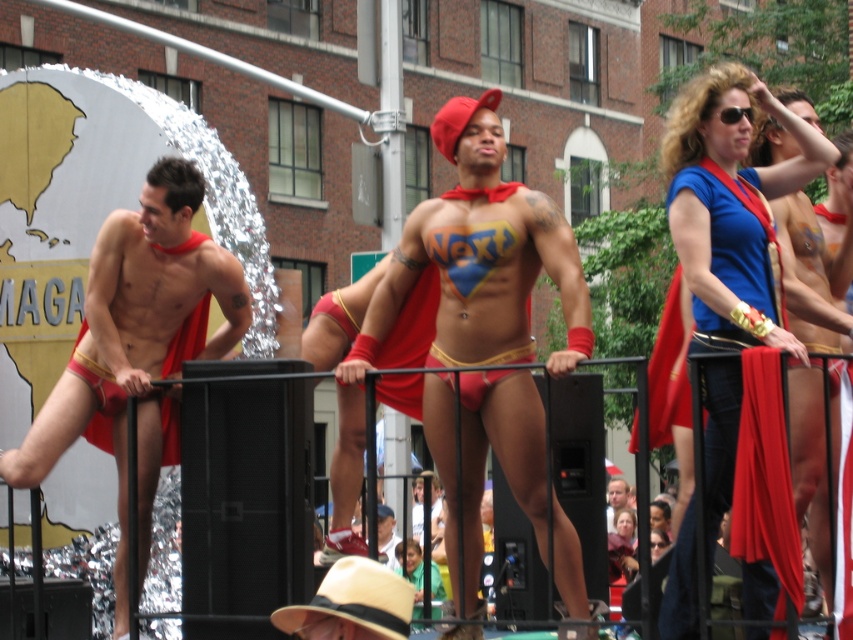
Question: Considering the real-world distances, which object is closest to the blue fabric cape at upper right?

Choices:
 (A) matte red cape at center
 (B) matte red underwear at center
 (C) matte gold underwear at left

Answer: (B)

Question: Does matte gold underwear at left have a larger size compared to blue fabric cape at upper right?

Choices:
 (A) no
 (B) yes

Answer: (A)

Question: Can you confirm if matte gold underwear at left is positioned to the left of blue fabric cape at upper right?

Choices:
 (A) no
 (B) yes

Answer: (B)

Question: Which point is farther from the camera taking this photo?

Choices:
 (A) (225, 352)
 (B) (378, 328)

Answer: (A)

Question: Which of the following is the farthest from the observer?

Choices:
 (A) blue fabric cape at upper right
 (B) matte gold underwear at left
 (C) matte red underwear at center
 (D) matte red cape at center

Answer: (D)

Question: Is matte red underwear at center further to the viewer compared to blue fabric cape at upper right?

Choices:
 (A) no
 (B) yes

Answer: (B)